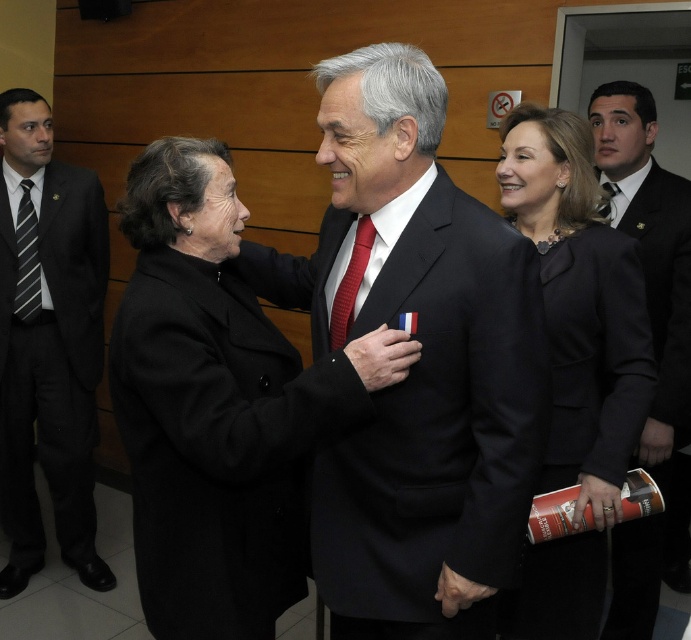
Question: Among these points, which one is nearest to the camera?

Choices:
 (A) (377, 381)
 (B) (330, 308)

Answer: (A)

Question: Which of the following is the farthest from the observer?

Choices:
 (A) matte black hand at center
 (B) black suit at left

Answer: (B)

Question: Which object is closer to the camera taking this photo?

Choices:
 (A) black wool coat at center
 (B) matte red tie at center

Answer: (A)

Question: Does matte black suit at center come in front of black suit at left?

Choices:
 (A) no
 (B) yes

Answer: (B)

Question: Is black wool coat at center positioned behind red silk tie at center?

Choices:
 (A) yes
 (B) no

Answer: (B)

Question: Does black suit at right have a lesser width compared to red silk tie at center?

Choices:
 (A) no
 (B) yes

Answer: (A)